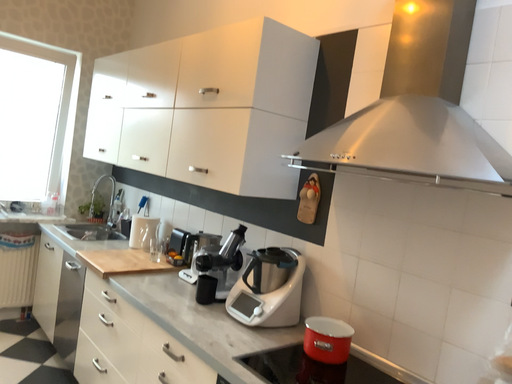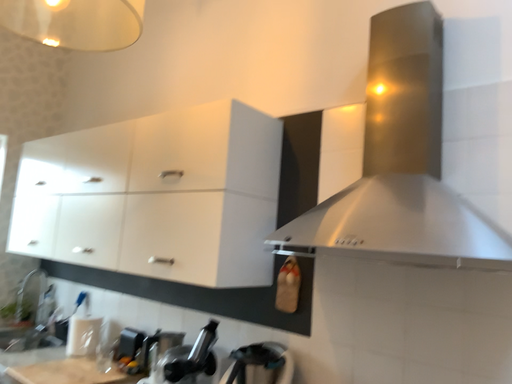
Question: How did the camera likely rotate when shooting the video?

Choices:
 (A) rotated left
 (B) rotated right

Answer: (B)